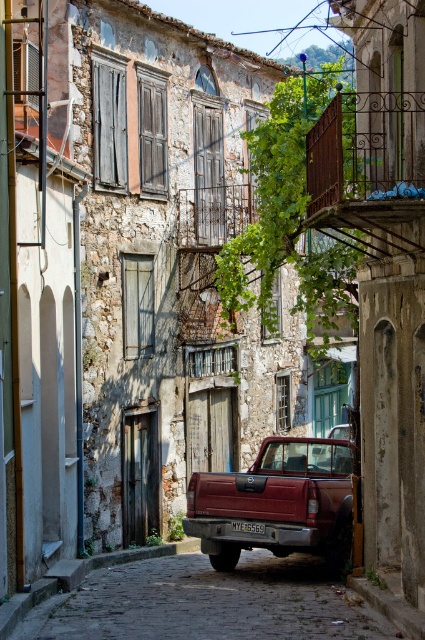
Looking at this image, you are a delivery driver who needs to park your matte red truck at center in this alley. The city requires that license plates must be visible at all times. Is the black plastic license plate at center currently visible from the front of the truck?

The matte red truck at center is positioned over the black plastic license plate at center, so the license plate is not visible from the front of the truck.

You are a delivery driver who needs to back out of the narrow alley. The matte red truck at center and the black plastic license plate at center are in your way. Which object should you move first to ensure safe passage?

The matte red truck at center is to the right of the black plastic license plate at center, so you should move the matte red truck at center first to allow space to maneuver out of the alley.

You are standing in the middle of the narrow cobblestone alleyway between the old buildings. You need to walk to the red pickup truck parked at the end of the alley. According to the map, the rustic stone cobblestone street at center is located at coordinates 0.944, 0.485. Can you determine if the path to the truck is directly ahead of you or to the side?

The rustic stone cobblestone street at center is located at coordinates (x=206, y=604), which indicates it is positioned towards the lower right of the image. Since the truck is at the end of the alley, the path to it would be directly ahead along the street.